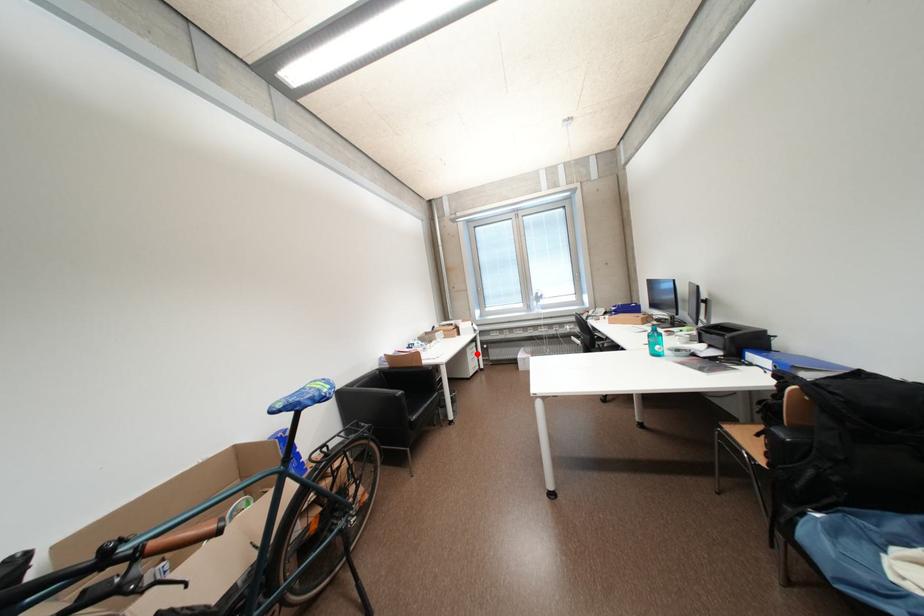
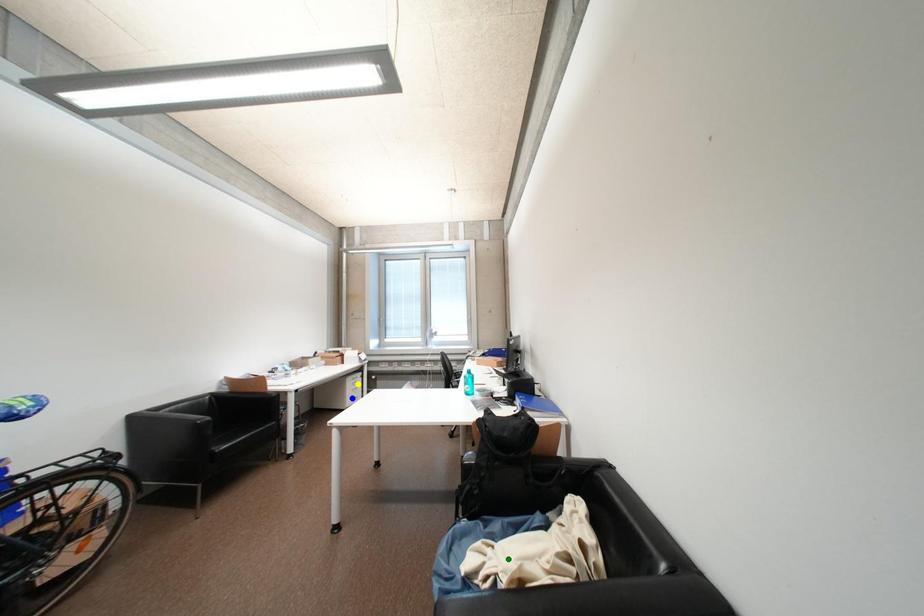
Question: I am providing you with two images of the same scene from different viewpoints. A red point is marked on the first image. You are given multiple points on the second image. Can you choose the point in image 2 that corresponds to the point in image 1?

Choices:
 (A) blue point
 (B) yellow point
 (C) green point

Answer: (B)